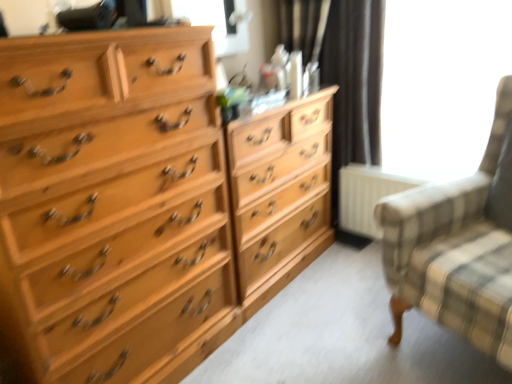
Question: Can you confirm if white matte radiator at lower right is smaller than clear glass window screen at upper center, which is counted as the second window screen, starting from the right?

Choices:
 (A) no
 (B) yes

Answer: (A)

Question: Is white matte radiator at lower right positioned far away from clear glass window screen at upper center, which is counted as the second window screen, starting from the right?

Choices:
 (A) yes
 (B) no

Answer: (A)

Question: From the image's perspective, is white matte radiator at lower right located beneath clear glass window screen at upper center, which is the first window screen from left to right?

Choices:
 (A) yes
 (B) no

Answer: (A)

Question: Would you say white matte radiator at lower right is outside clear glass window screen at upper center, which is the first window screen from left to right?

Choices:
 (A) yes
 (B) no

Answer: (A)

Question: Is white matte radiator at lower right beside clear glass window screen at upper center, which is the first window screen from left to right?

Choices:
 (A) no
 (B) yes

Answer: (A)

Question: Is white matte radiator at lower right facing away from clear glass window screen at upper center, which is the first window screen from left to right?

Choices:
 (A) no
 (B) yes

Answer: (A)

Question: Does light wood dresser at center have a greater height compared to clear glass window screen at upper center, which is counted as the second window screen, starting from the right?

Choices:
 (A) yes
 (B) no

Answer: (A)

Question: Is light wood dresser at center thinner than clear glass window screen at upper center, which is the first window screen from left to right?

Choices:
 (A) yes
 (B) no

Answer: (B)

Question: Is light wood dresser at center to the right of clear glass window screen at upper center, which is the first window screen from left to right, from the viewer's perspective?

Choices:
 (A) no
 (B) yes

Answer: (B)

Question: Is light wood dresser at center located outside clear glass window screen at upper center, which is the first window screen from left to right?

Choices:
 (A) yes
 (B) no

Answer: (A)

Question: Does light wood dresser at center have a greater width compared to clear glass window screen at upper center, which is counted as the second window screen, starting from the right?

Choices:
 (A) no
 (B) yes

Answer: (B)

Question: From a real-world perspective, is light wood dresser at center located beneath clear glass window screen at upper center, which is the first window screen from left to right?

Choices:
 (A) yes
 (B) no

Answer: (A)

Question: Does light wood chest of drawers at left come in front of light wood dresser at center?

Choices:
 (A) yes
 (B) no

Answer: (A)